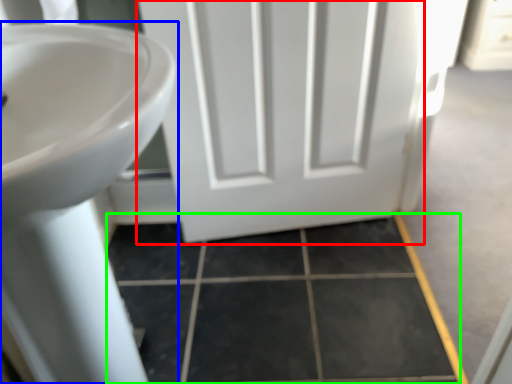
Question: Which object is positioned farthest from door (highlighted by a red box)? Select from sink (highlighted by a blue box) and tile (highlighted by a green box).

Choices:
 (A) sink
 (B) tile

Answer: (A)